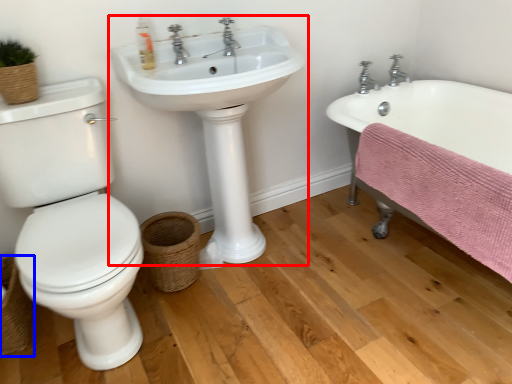
Question: Which object is closer to the camera taking this photo, sink (highlighted by a red box) or basket (highlighted by a blue box)?

Choices:
 (A) sink
 (B) basket

Answer: (A)